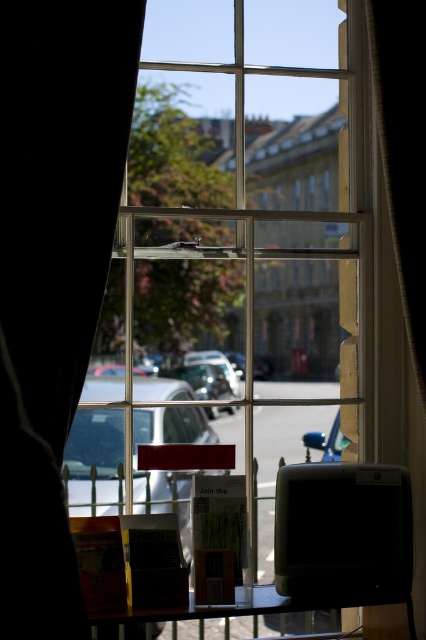
You are an interior designer planning to take a photo through the window. The black fabric curtain at right and the metallic silver car at center are both in the frame. Which object is closer to the window?

The black fabric curtain at right is closer to the window than the metallic silver car at center because it is positioned over it.

You are standing inside the room looking through the multi paned window. The black fabric curtain at right is partially covering the window. Can you see the parked cars outside through the window? Explain why or why not.

The black fabric curtain at right is positioned at point (403, 150), which is near the bottom right corner of the window. Since it is only partially covering the window, most of the window remains uncovered, allowing visibility of the parked cars outside through the remaining open area.

You are a delivery person trying to deliver a package through the window. The package is 18 inches wide. Can you fit the package between the black fabric curtain at right and the shiny blue car at center?

The black fabric curtain at right is 17.70 inches away from the shiny blue car at center. Since the package is 18 inches wide, it cannot fit through the gap between the black fabric curtain at right and the shiny blue car at center.